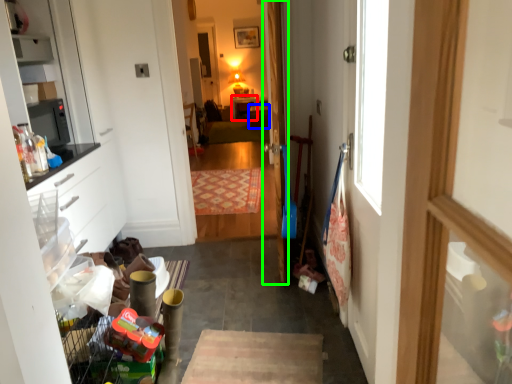
Question: Which is nearer to the table (highlighted by a red box)? cabinetry (highlighted by a blue box) or door (highlighted by a green box).

Choices:
 (A) cabinetry
 (B) door

Answer: (A)